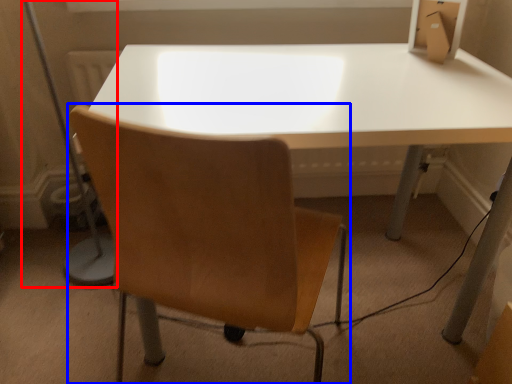
Question: Which object appears farthest to the camera in this image, table lamp (highlighted by a red box) or chair (highlighted by a blue box)?

Choices:
 (A) table lamp
 (B) chair

Answer: (A)